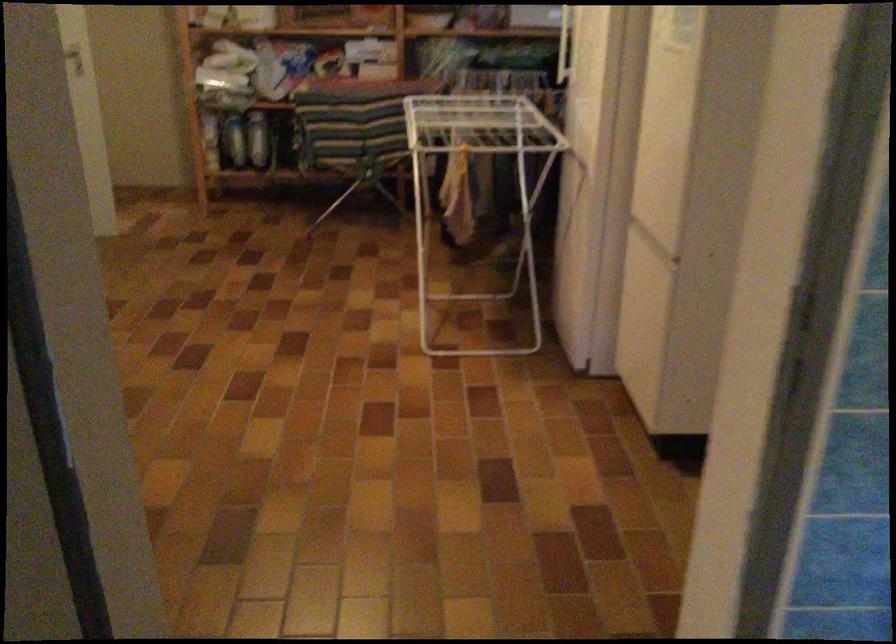
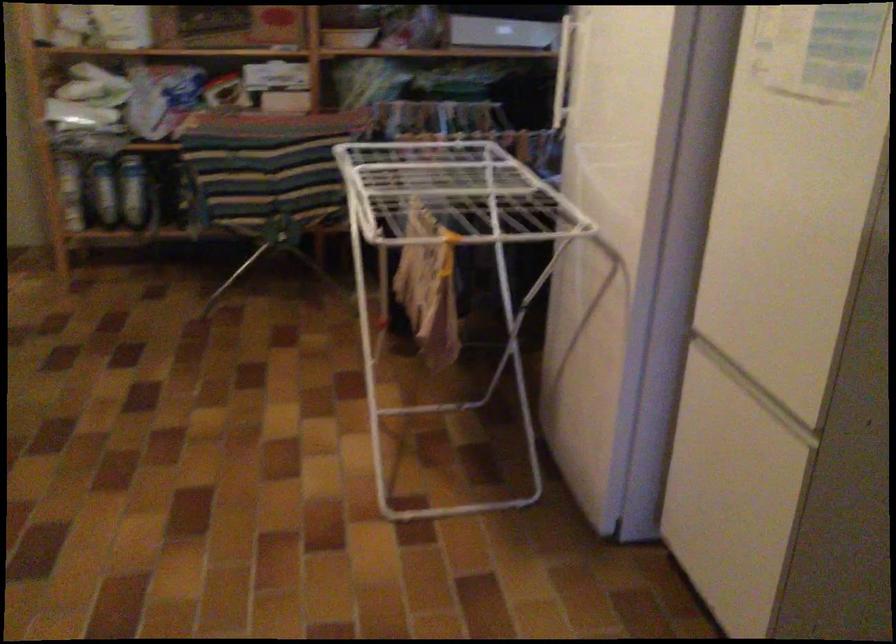
In the second image, find the point that corresponds to the point at 460,156 in the first image.

(450, 258)